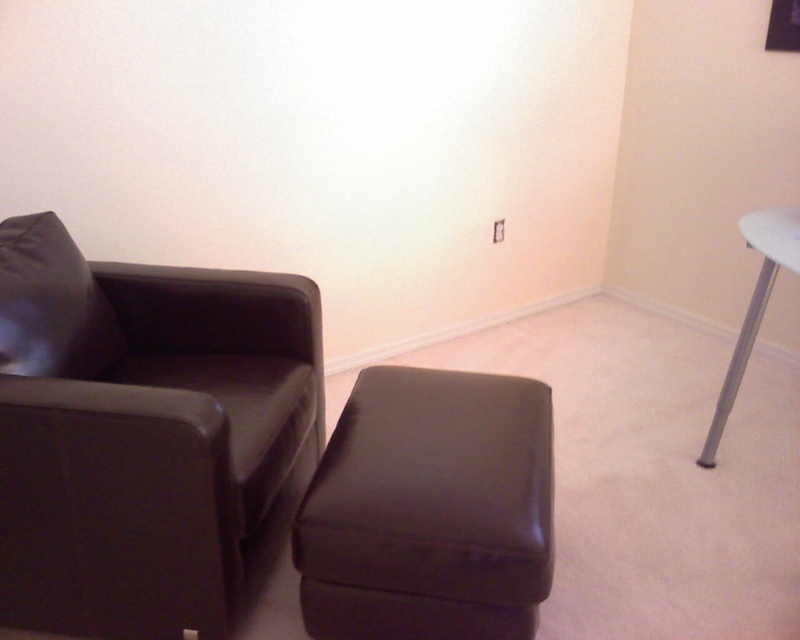
You are sitting in the dark brown leather armchair and want to place a matte black pillow at left on the matte black ottoman at center. Can the pillow fit on the ottoman based on their heights?

The matte black ottoman at center is taller than the matte black pillow at left, so the pillow can be placed on the ottoman since the ottoman has sufficient height to support it.

You are trying to place a small book between the matte brown leather swivel chair at left and the matte black pillow at left. The book is 6 inches thick. Will it fit in the space between them?

The space between the matte brown leather swivel chair at left and the matte black pillow at left is 6.16 inches, so yes, the book will fit since it is thinner than the available space.